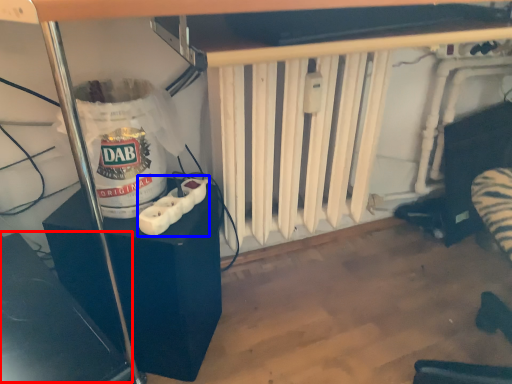
Question: Which object appears closest to the camera in this image, wide (highlighted by a red box) or Wii controller (highlighted by a blue box)?

Choices:
 (A) wide
 (B) Wii controller

Answer: (A)